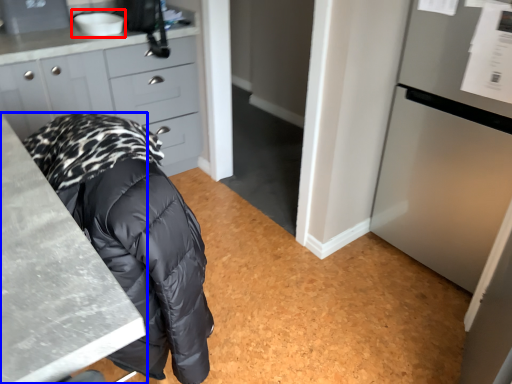
Question: Which object appears farthest to the camera in this image, sink (highlighted by a red box) or countertop (highlighted by a blue box)?

Choices:
 (A) sink
 (B) countertop

Answer: (A)